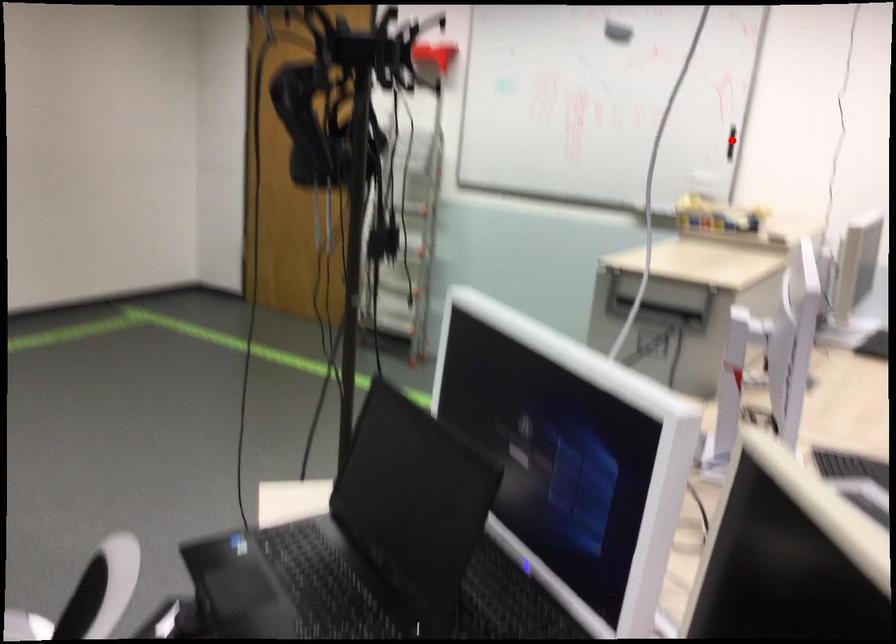
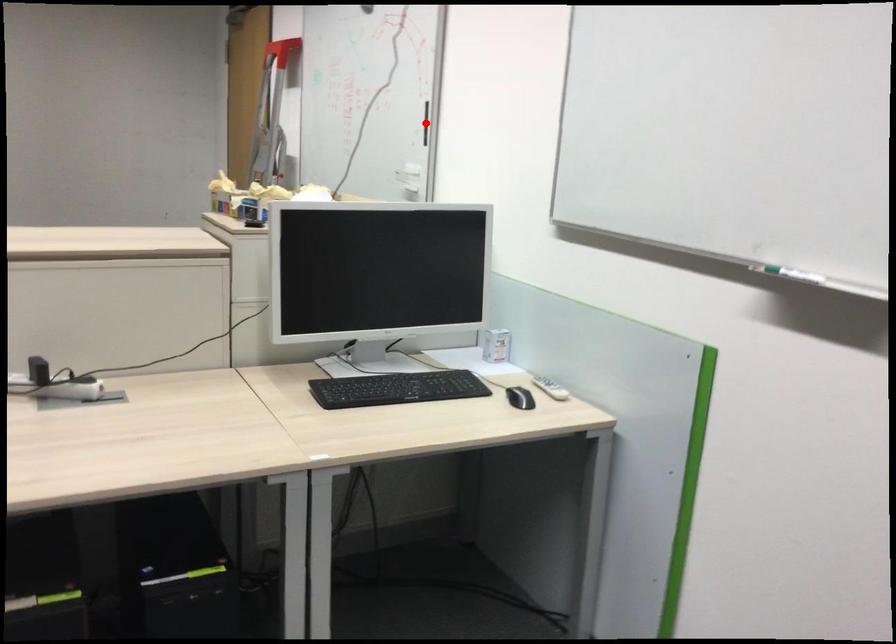
I am providing you with two images of the same scene from different viewpoints. A red point is marked on the first image and another point is marked on the second image. Does the point marked in image1 correspond to the same location as the one in image2?

Yes